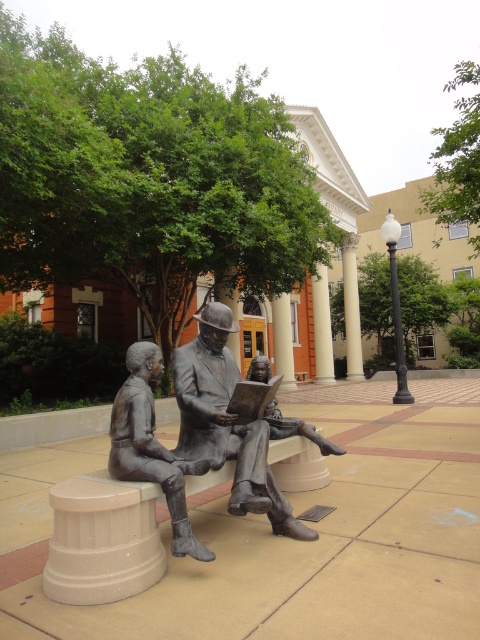
You are an art student analyzing the bronze statues in the plaza. You notice two statues labeled as the bronze statue of man reading at center and the bronze statue of man reading book at center. Which statue is taller?

The bronze statue of man reading at center is taller than the bronze statue of man reading book at center.

You are an art curator planning to display both the bronze statue of man reading at center and the bronze statue of man reading book at center in a narrow gallery space. Based on their widths, which statue should be placed first to ensure they both fit?

The bronze statue of man reading book at center is narrower than the bronze statue of man reading at center, so place the bronze statue of man reading book at center first to accommodate both in the narrow space.